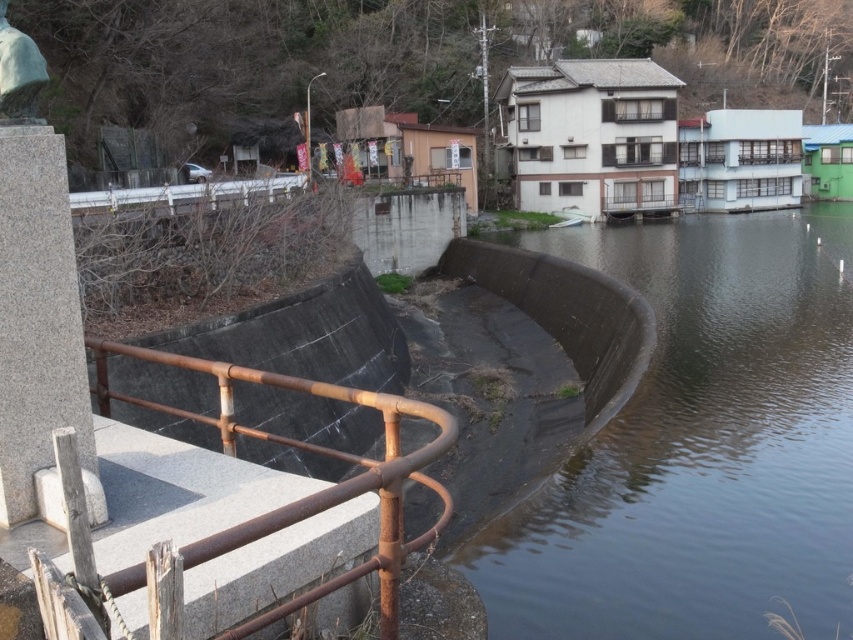
You are standing on the riverside walkway and notice the rusty metal railing at lower left and the green stone statue at upper left. Which object is positioned more to the left side of the scene?

→ The rusty metal railing at lower left is positioned more to the left side of the scene compared to the green stone statue at upper left.

You are a maintenance worker tasked with inspecting the green stone statue at upper left and the rusty metal railing at lower left. From your current position, which object is closer to you?

The rusty metal railing at lower left is closer to you since it is in front of the green stone statue at upper left, which is positioned behind it.